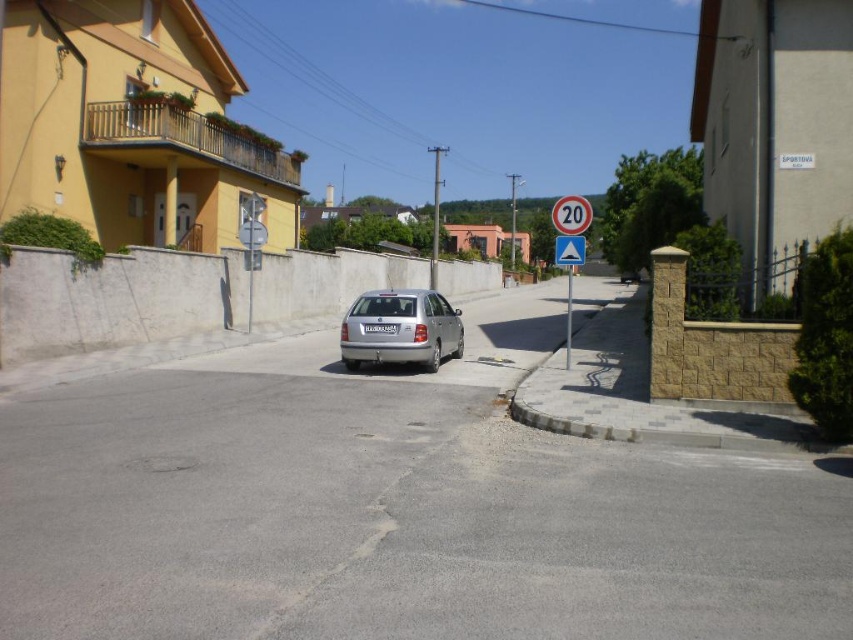
Question: Is silver metallic car at center wider than reflective plastic yield sign at center?

Choices:
 (A) no
 (B) yes

Answer: (A)

Question: Which of the following is the closest to the observer?

Choices:
 (A) (556, 250)
 (B) (386, 324)

Answer: (B)

Question: Is silver metallic car at center above reflective plastic yield sign at center?

Choices:
 (A) no
 (B) yes

Answer: (A)

Question: Among these points, which one is nearest to the camera?

Choices:
 (A) (556, 241)
 (B) (343, 358)

Answer: (A)

Question: Does silver metallic car at center have a lesser width compared to reflective plastic yield sign at center?

Choices:
 (A) no
 (B) yes

Answer: (B)

Question: Among these points, which one is farthest from the camera?

Choices:
 (A) (572, 243)
 (B) (345, 365)

Answer: (B)